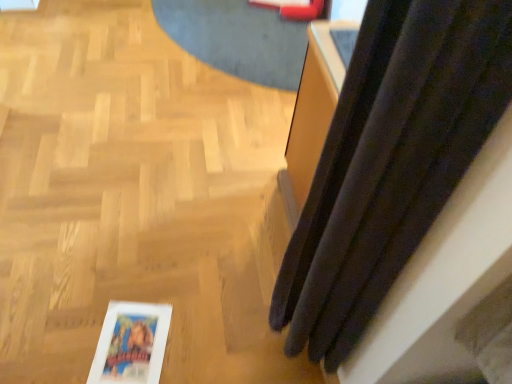
Where is `blank space to the left of white glossy magazine at lower left`? The height and width of the screenshot is (384, 512). blank space to the left of white glossy magazine at lower left is located at coordinates (65, 333).